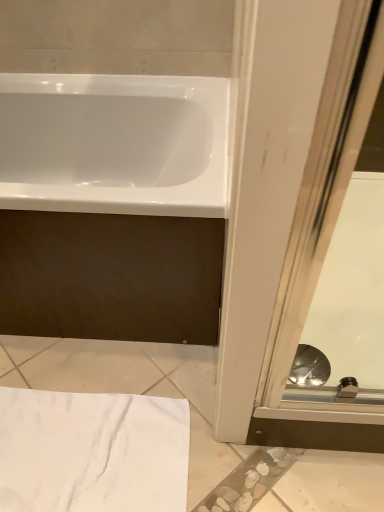
Question: Is white glossy bathtub at upper left positioned beyond the bounds of transparent glass screen door at lower right?

Choices:
 (A) yes
 (B) no

Answer: (A)

Question: From the image's perspective, is white glossy bathtub at upper left above transparent glass screen door at lower right?

Choices:
 (A) no
 (B) yes

Answer: (B)

Question: Is white glossy bathtub at upper left further to the viewer compared to transparent glass screen door at lower right?

Choices:
 (A) no
 (B) yes

Answer: (A)

Question: Considering the relative sizes of white glossy bathtub at upper left and transparent glass screen door at lower right in the image provided, is white glossy bathtub at upper left taller than transparent glass screen door at lower right?

Choices:
 (A) no
 (B) yes

Answer: (B)

Question: Does white glossy bathtub at upper left have a lesser height compared to transparent glass screen door at lower right?

Choices:
 (A) no
 (B) yes

Answer: (A)

Question: Does white glossy bathtub at upper left have a smaller size compared to transparent glass screen door at lower right?

Choices:
 (A) yes
 (B) no

Answer: (B)

Question: From a real-world perspective, is white glossy bathtub at upper left over white cotton towel at lower left?

Choices:
 (A) yes
 (B) no

Answer: (A)

Question: Considering the relative sizes of white glossy bathtub at upper left and white cotton towel at lower left in the image provided, is white glossy bathtub at upper left smaller than white cotton towel at lower left?

Choices:
 (A) yes
 (B) no

Answer: (B)

Question: Does white glossy bathtub at upper left turn towards white cotton towel at lower left?

Choices:
 (A) yes
 (B) no

Answer: (A)

Question: From the image's perspective, is white glossy bathtub at upper left under white cotton towel at lower left?

Choices:
 (A) yes
 (B) no

Answer: (B)

Question: Is white glossy bathtub at upper left taller than white cotton towel at lower left?

Choices:
 (A) yes
 (B) no

Answer: (A)

Question: Can you confirm if white glossy bathtub at upper left is bigger than white cotton towel at lower left?

Choices:
 (A) no
 (B) yes

Answer: (B)

Question: Can you confirm if white cotton towel at lower left is bigger than transparent glass screen door at lower right?

Choices:
 (A) no
 (B) yes

Answer: (A)